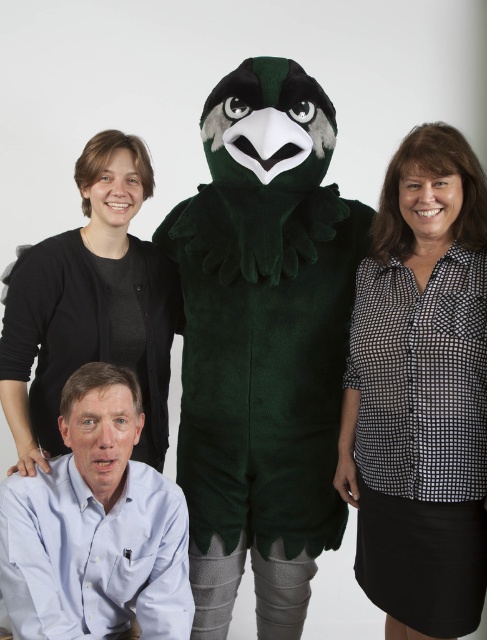
Who is taller, black checkered shirt at right or light blue shirt at lower left?

black checkered shirt at right is taller.

Who is positioned more to the right, black checkered shirt at right or light blue shirt at lower left?

black checkered shirt at right

Between point (480, 384) and point (93, 365), which one is positioned in front?

Positioned in front is point (93, 365).

Where is `black checkered shirt at right`? The height and width of the screenshot is (640, 487). black checkered shirt at right is located at coordinates (420, 392).

Is black checkered shirt at right above black soft sweater at upper left?

Actually, black checkered shirt at right is below black soft sweater at upper left.

Is point (354, 497) behind point (165, 372)?

No.

Between point (380, 545) and point (44, 412), which one is positioned in front?

Point (380, 545) is more forward.

This screenshot has height=640, width=487. In order to click on black checkered shirt at right in this screenshot , I will do `click(420, 392)`.

Is light blue shirt at lower left above black soft sweater at upper left?

Actually, light blue shirt at lower left is below black soft sweater at upper left.

Does light blue shirt at lower left have a greater width compared to black soft sweater at upper left?

In fact, light blue shirt at lower left might be narrower than black soft sweater at upper left.

Describe the element at coordinates (95, 525) in the screenshot. The width and height of the screenshot is (487, 640). I see `light blue shirt at lower left` at that location.

What are the coordinates of `light blue shirt at lower left` in the screenshot? It's located at (95, 525).